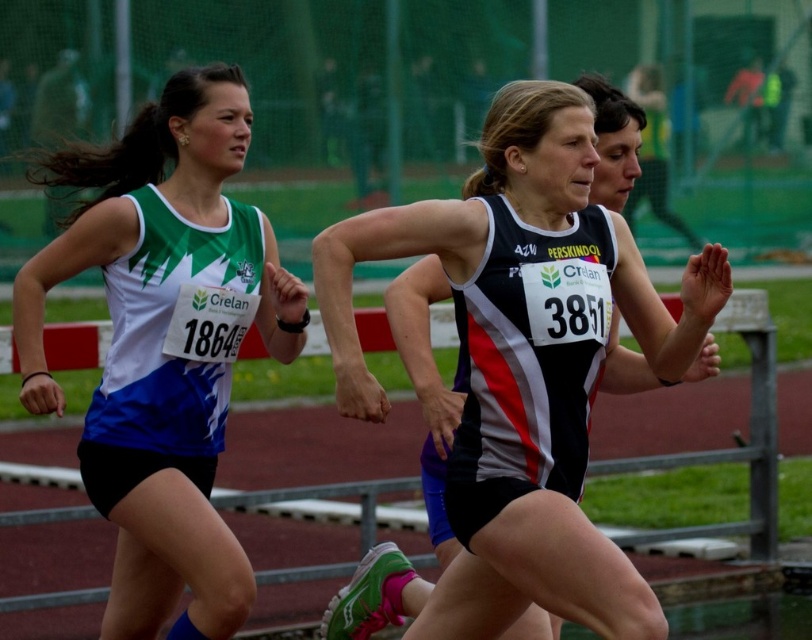
Does black and white athletic top at center lie in front of matte green and white tank top at left?

That is True.

Is point (508, 522) positioned in front of point (111, 221)?

Yes.

Where is `black and white athletic top at center`? Image resolution: width=812 pixels, height=640 pixels. black and white athletic top at center is located at coordinates (525, 371).